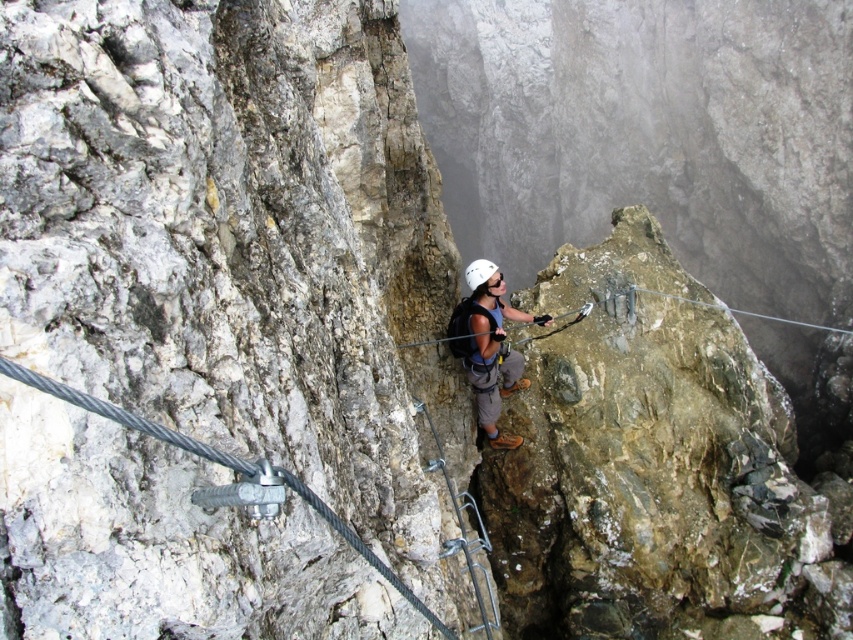
Question: Is metallic wire at center positioned before white matte helmet at center?

Choices:
 (A) yes
 (B) no

Answer: (A)

Question: Among these points, which one is nearest to the camera?

Choices:
 (A) (38, 380)
 (B) (479, 276)
 (C) (489, 358)

Answer: (A)

Question: Can you confirm if matte blue shirt at center is positioned to the left of white matte helmet at center?

Choices:
 (A) yes
 (B) no

Answer: (B)

Question: Which point is closer to the camera?

Choices:
 (A) (483, 378)
 (B) (317, 499)

Answer: (B)

Question: Is matte blue shirt at center further to camera compared to white matte helmet at center?

Choices:
 (A) yes
 (B) no

Answer: (B)

Question: Which point appears closest to the camera in this image?

Choices:
 (A) (485, 273)
 (B) (498, 285)
 (C) (77, 403)

Answer: (C)